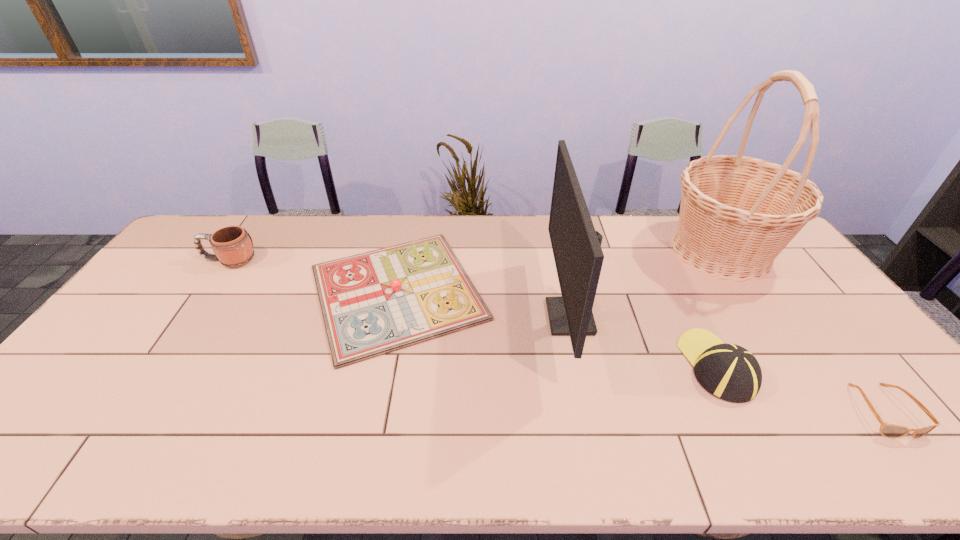
The width and height of the screenshot is (960, 540). Find the location of `basket`. basket is located at coordinates (737, 213).

Where is `computer monitor`? computer monitor is located at coordinates (578, 255).

You are a GUI agent. You are given a task and a screenshot of the screen. Output one action in this format:
    pyautogui.click(x=<x>, y=<y>)
    Task: Click on the third object from left to right
    Image resolution: width=960 pixels, height=540 pixels.
    Given the screenshot: What is the action you would take?
    pyautogui.click(x=578, y=255)

This screenshot has width=960, height=540. Identify the location of mug. (232, 245).

Locate an element on the screen. This screenshot has width=960, height=540. baseball cap is located at coordinates (730, 372).

Locate an element on the screen. The height and width of the screenshot is (540, 960). the second object from left to right is located at coordinates (373, 303).

Locate an element on the screen. Image resolution: width=960 pixels, height=540 pixels. sunglasses is located at coordinates (887, 430).

What are the coordinates of `vacant space located 0.390m on the left of the tallest object` in the screenshot? It's located at click(x=551, y=251).

Locate an element on the screen. free point located on the front-facing side of the computer monitor is located at coordinates [496, 317].

The width and height of the screenshot is (960, 540). I want to click on vacant space located 0.150m on the front-facing side of the computer monitor, so 496,317.